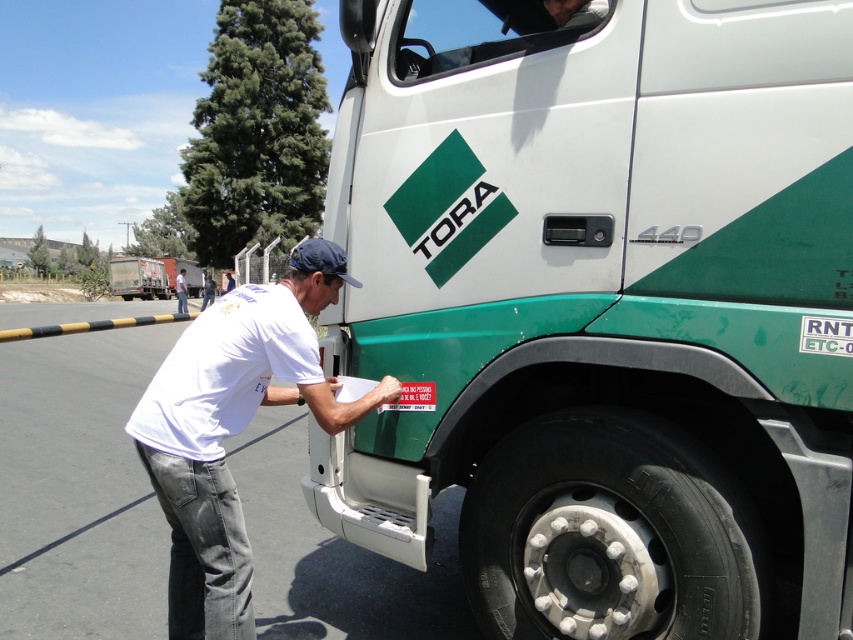
You are a delivery driver who needs to park the green matte trailer truck at left and the green matte trailer truck at upper center in a parking lot with height restrictions. Which truck might have difficulty fitting under the height limit?

The green matte trailer truck at left is taller than the green matte trailer truck at upper center, so the green matte trailer truck at left might have difficulty fitting under the height limit.

Based on the coordinates provided, can you identify the object located at point [137,276] in the image?

The point [137,276] corresponds to the green matte trailer truck at left.

Based on the scene, which object is wider, the white cotton shirt at lower left or the matte black headrest at upper center?

The white cotton shirt at lower left is wider than the matte black headrest at upper center according to the description.